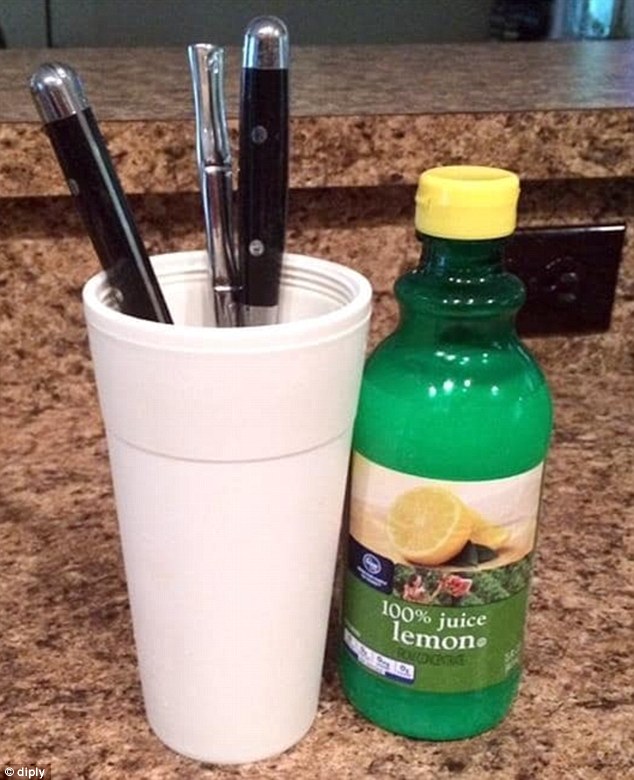
The image size is (634, 780). I want to click on top outlet, so [565, 289].